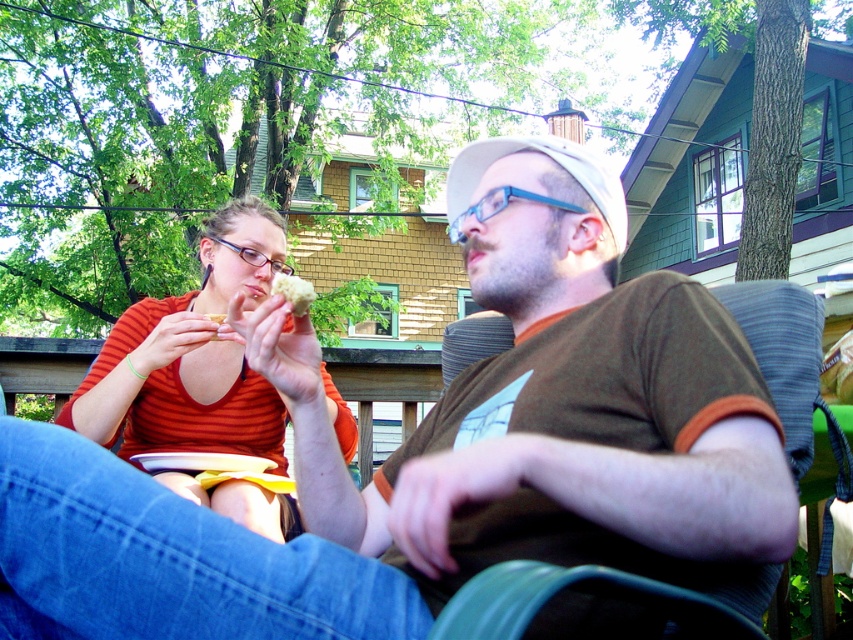
Does orange striped shirt at upper left have a lesser width compared to yellow crumbly bread at upper center?

No.

Does orange striped shirt at upper left have a lesser height compared to yellow crumbly bread at upper center?

No, orange striped shirt at upper left is not shorter than yellow crumbly bread at upper center.

Which is in front, point (218, 260) or point (206, 316)?

Point (206, 316) is more forward.

The width and height of the screenshot is (853, 640). I want to click on orange striped shirt at upper left, so click(x=190, y=355).

Can you confirm if brown cotton shirt at center is positioned above orange striped shirt at upper left?

No.

Between brown cotton shirt at center and orange striped shirt at upper left, which one is positioned lower?

brown cotton shirt at center is lower down.

Locate an element on the screen. brown cotton shirt at center is located at coordinates (440, 448).

Who is taller, brown cotton shirt at center or white crumbly bread at center?

brown cotton shirt at center is taller.

Does brown cotton shirt at center have a greater width compared to white crumbly bread at center?

Correct, the width of brown cotton shirt at center exceeds that of white crumbly bread at center.

Is point (328, 433) less distant than point (276, 284)?

Yes, it is in front of point (276, 284).

You are a GUI agent. You are given a task and a screenshot of the screen. Output one action in this format:
    pyautogui.click(x=<x>, y=<y>)
    Task: Click on the brown cotton shirt at center
    This screenshot has width=853, height=640.
    Given the screenshot: What is the action you would take?
    pyautogui.click(x=440, y=448)